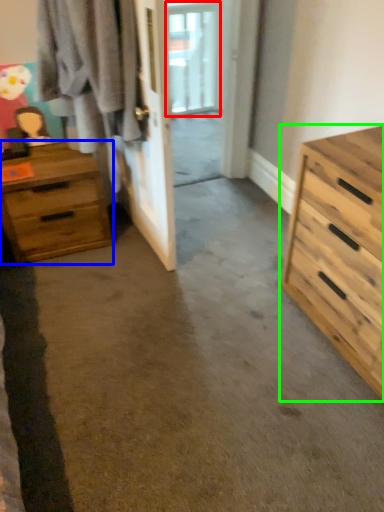
Question: Based on their relative distances, which object is farther from window (highlighted by a red box)? Choose from chest of drawers (highlighted by a blue box) and chest of drawers (highlighted by a green box).

Choices:
 (A) chest of drawers
 (B) chest of drawers

Answer: (B)